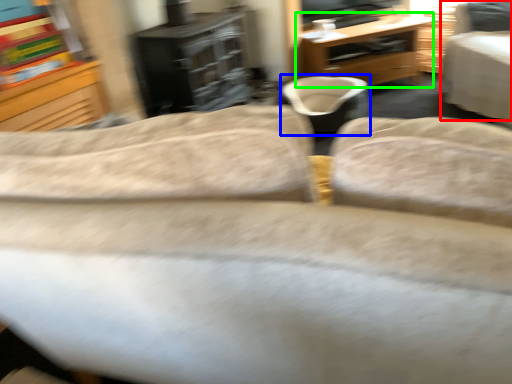
Question: Which is farther away from chair (highlighted by a red box)? bean bag chair (highlighted by a blue box) or desk (highlighted by a green box)?

Choices:
 (A) bean bag chair
 (B) desk

Answer: (B)